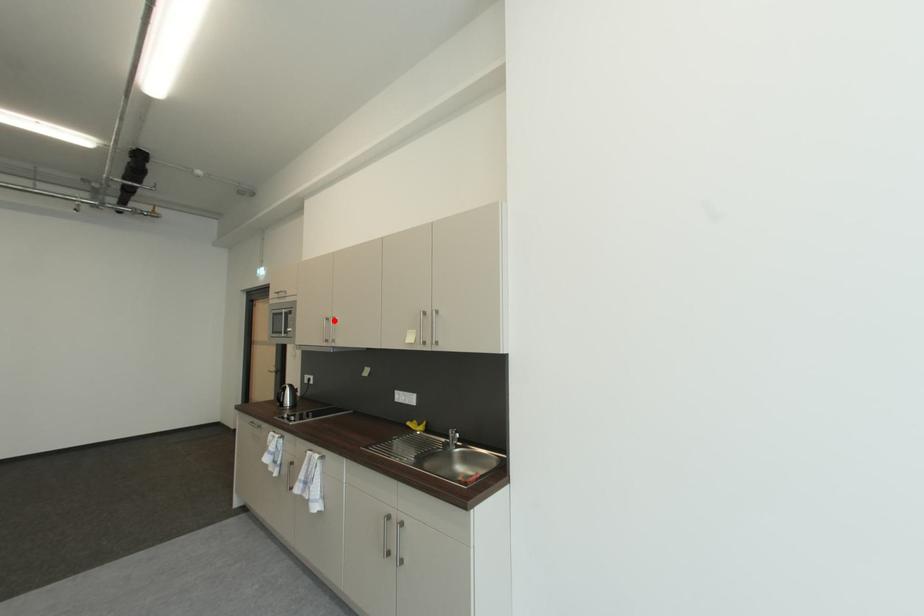
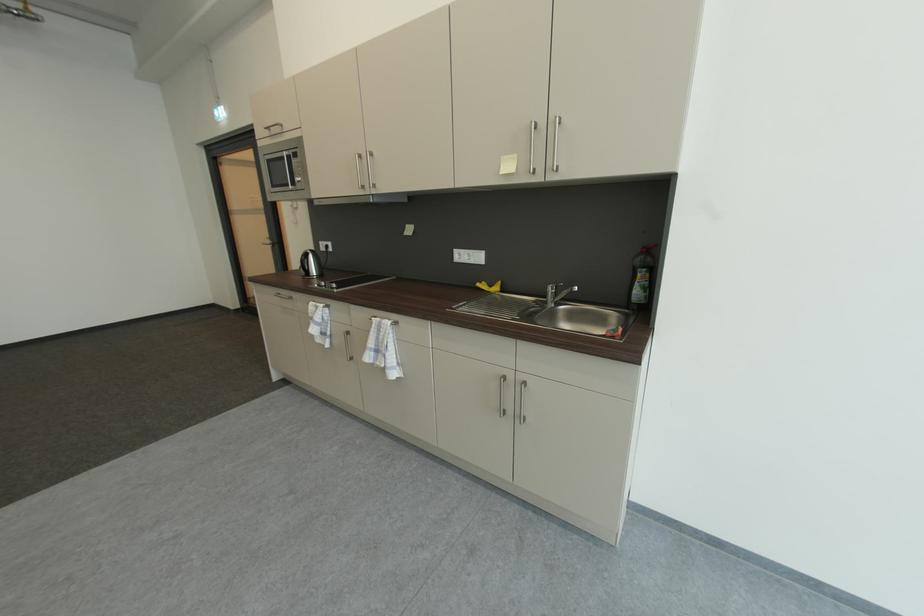
In the second image, find the point that corresponds to the highlighted location in the first image.

(367, 158)